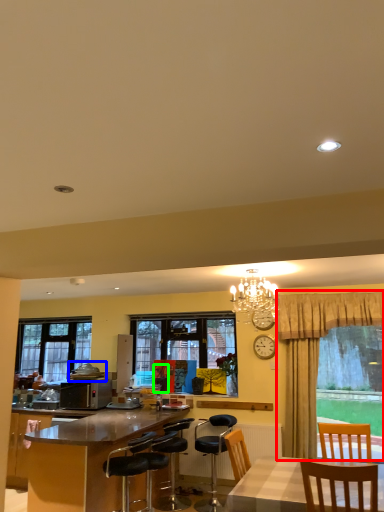
Question: Which object is the closest to the curtain (highlighted by a red box)? Choose among these: tableware (highlighted by a blue box) or person (highlighted by a green box).

Choices:
 (A) tableware
 (B) person

Answer: (B)